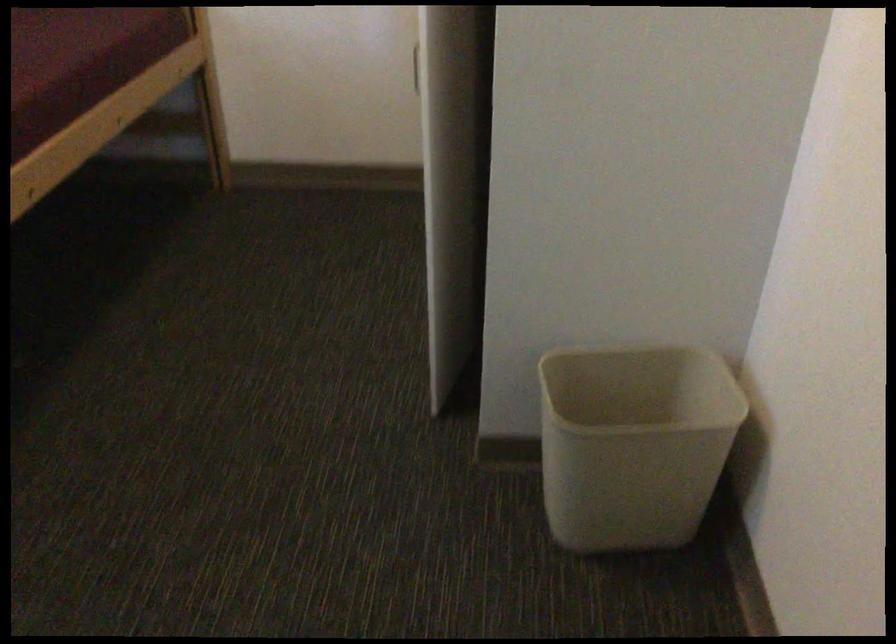
Find the location of a particular element. white trash can is located at coordinates (633, 442).